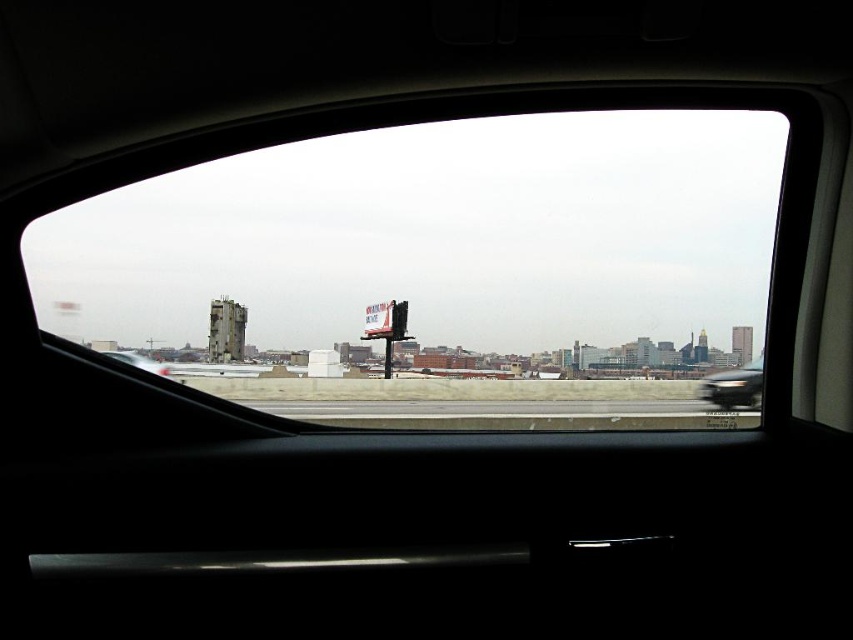
Question: Is transparent glass windshield at center positioned at the back of gray concrete runway at center?

Choices:
 (A) no
 (B) yes

Answer: (A)

Question: Among these points, which one is nearest to the camera?

Choices:
 (A) (524, 404)
 (B) (438, 298)

Answer: (A)

Question: Can you confirm if gray concrete runway at center is positioned to the right of metallic silver sedan at lower right?

Choices:
 (A) no
 (B) yes

Answer: (A)

Question: Which point is closer to the camera?

Choices:
 (A) transparent glass windshield at center
 (B) gray concrete runway at center
 (C) metallic silver sedan at lower right

Answer: (A)

Question: Which of these objects is positioned closest to the transparent glass windshield at center?

Choices:
 (A) gray concrete runway at center
 (B) metallic silver sedan at lower right

Answer: (A)

Question: Is transparent glass windshield at center thinner than metallic silver sedan at lower right?

Choices:
 (A) yes
 (B) no

Answer: (B)